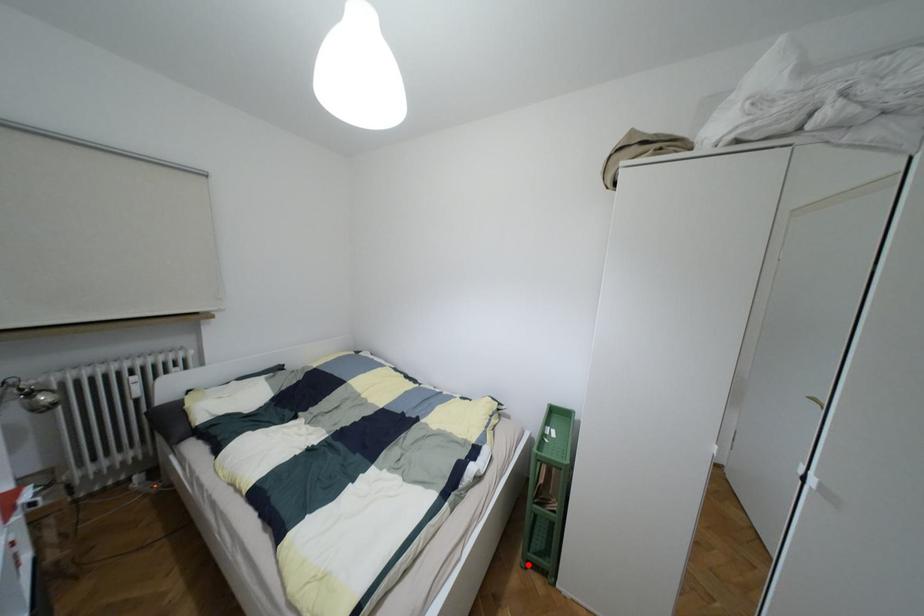
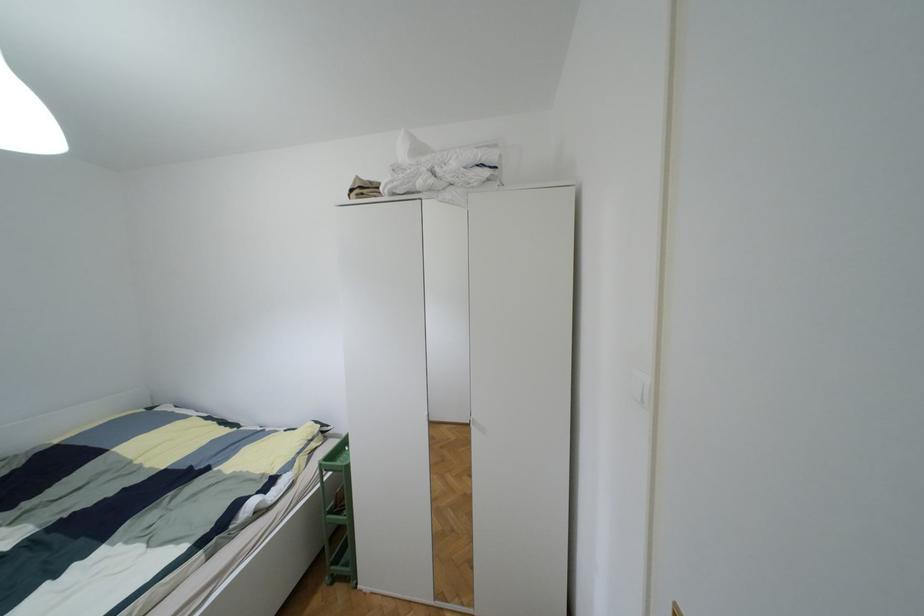
Question: I am providing you with two images of the same scene from different viewpoints. Image1 has a red point marked. In image2, the corresponding 3D location appears at what relative position? Reply with the corresponding letter.

Choices:
 (A) Closer
 (B) Farther

Answer: (B)